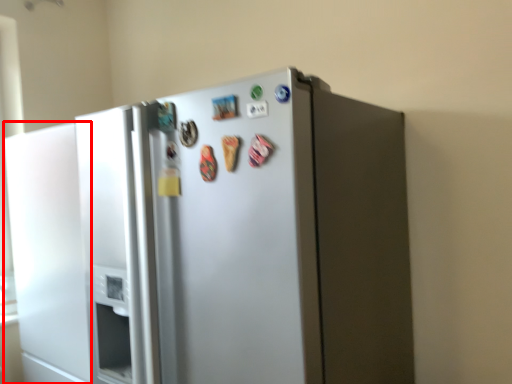
Question: In this image, where is door (annotated by the red box) located relative to refrigerator?

Choices:
 (A) right
 (B) left

Answer: (B)